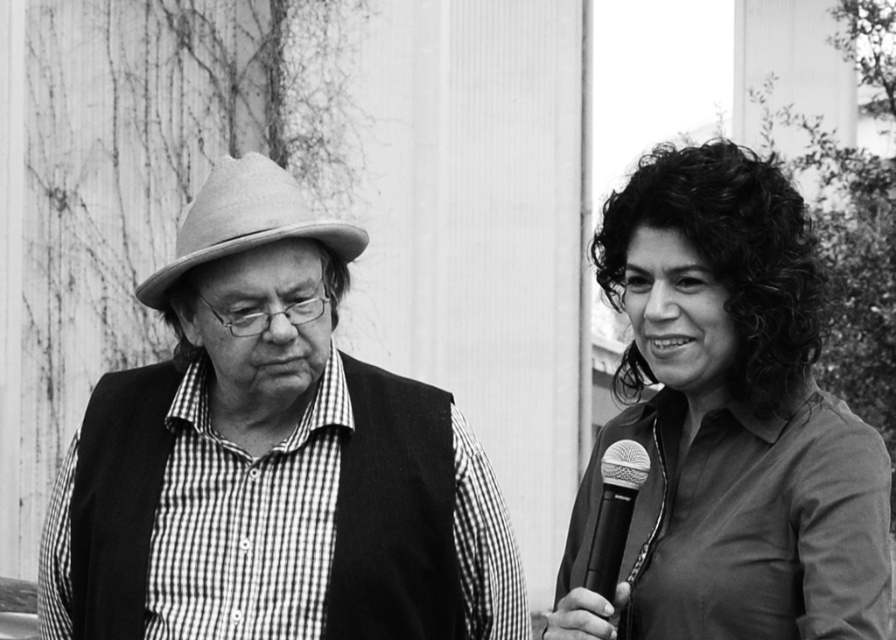
You are a photographer who wants to capture a closeup of the checkered fabric shirt at left and the felt fedora at left. Since you can only focus on one object at a time, which one should you choose to ensure the other remains in the background?

The checkered fabric shirt at left is positioned on the right side of felt fedora at left. To have the other in the background, focus on the felt fedora at left because it is closer to the camera, allowing the checkered fabric shirt at left to stay in the background.

You are organizing a small event and need to know if the checkered fabric shirt at left can be folded to fit into a storage box designed for items no wider than the metallic silver microphone at right. Based on the image, can the shirt be folded to fit?

The checkered fabric shirt at left is wider than the metallic silver microphone at right. Since the shirt is wider, it might not fit into the storage box unless folded carefully to reduce its width.